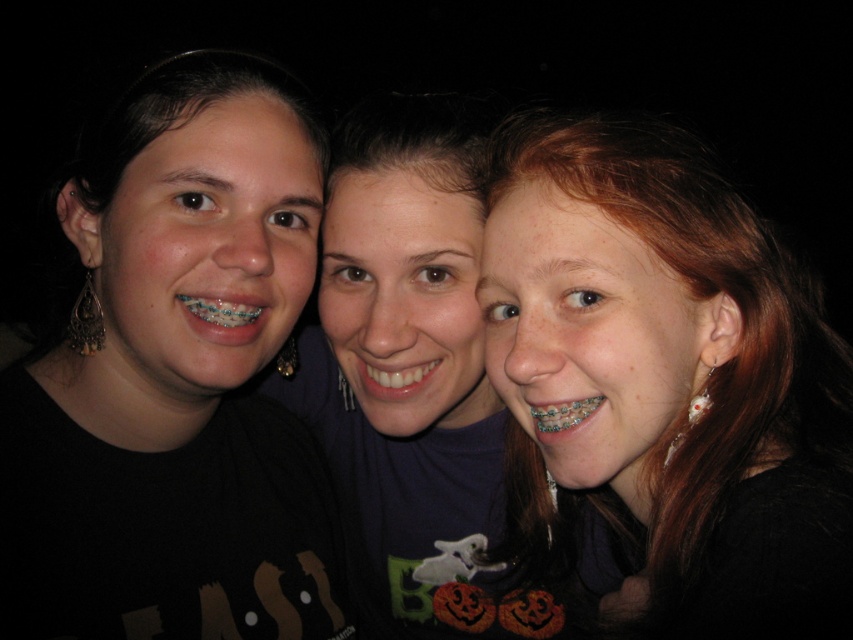
Question: Among these points, which one is nearest to the camera?

Choices:
 (A) (184, 305)
 (B) (428, 388)
 (C) (402, 392)

Answer: (A)

Question: Can you confirm if black matte shirt at left is wider than matte purple shirt at center?

Choices:
 (A) yes
 (B) no

Answer: (B)

Question: Among these points, which one is farthest from the camera?

Choices:
 (A) (274, 220)
 (B) (677, 376)
 (C) (605, 586)
 (D) (202, 310)

Answer: (C)

Question: Based on their relative distances, which object is farther from the matte purple shirt at center?

Choices:
 (A) white glossy teeth at center
 (B) matte black hair at center
 (C) black matte shirt at left
 (D) metallic braces at center

Answer: (D)

Question: Is black matte shirt at left above white glossy teeth at center?

Choices:
 (A) no
 (B) yes

Answer: (B)

Question: Is matte purple shirt at center wider than metallic braces at center?

Choices:
 (A) no
 (B) yes

Answer: (B)